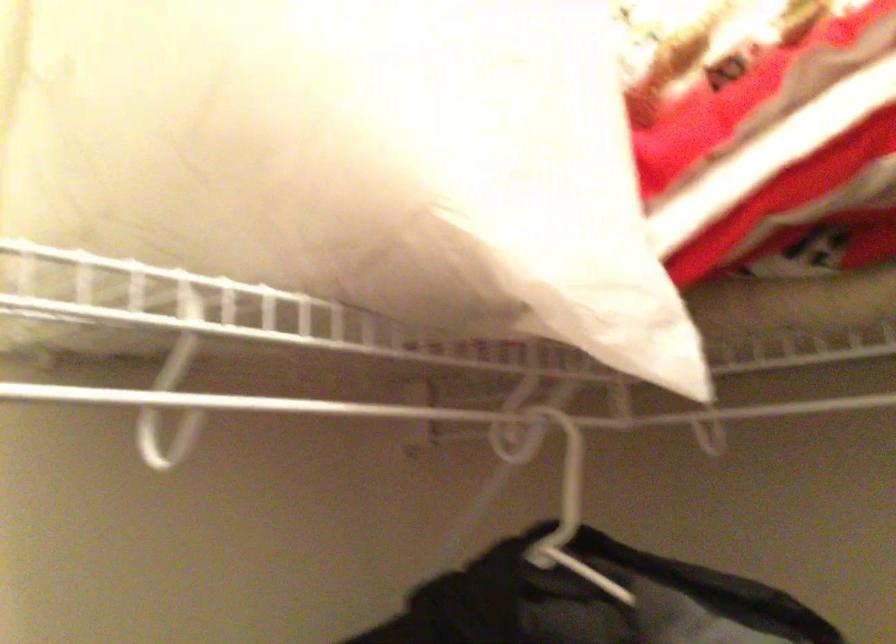
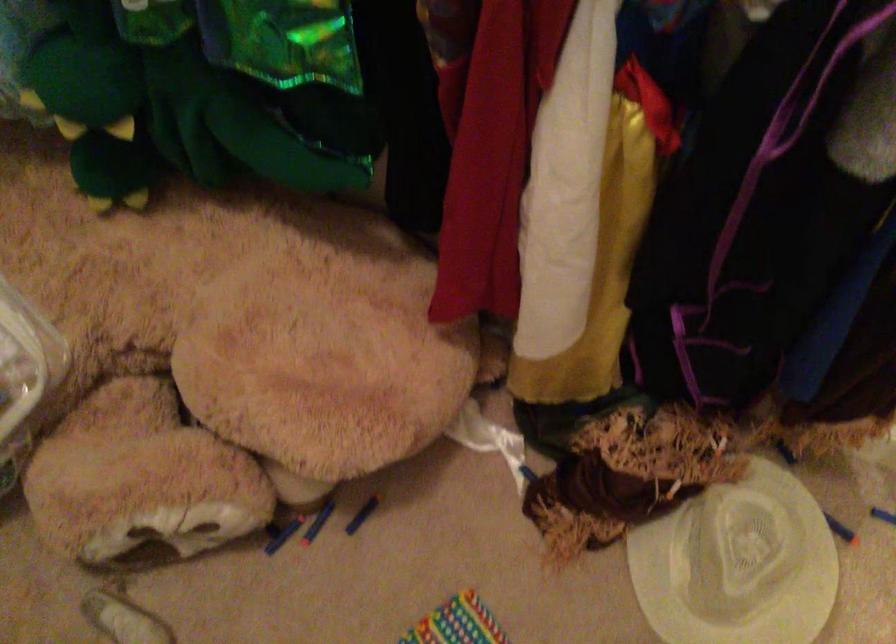
First-person continuous shooting, in which direction is the camera rotating?

The camera's rotation is toward right-down.